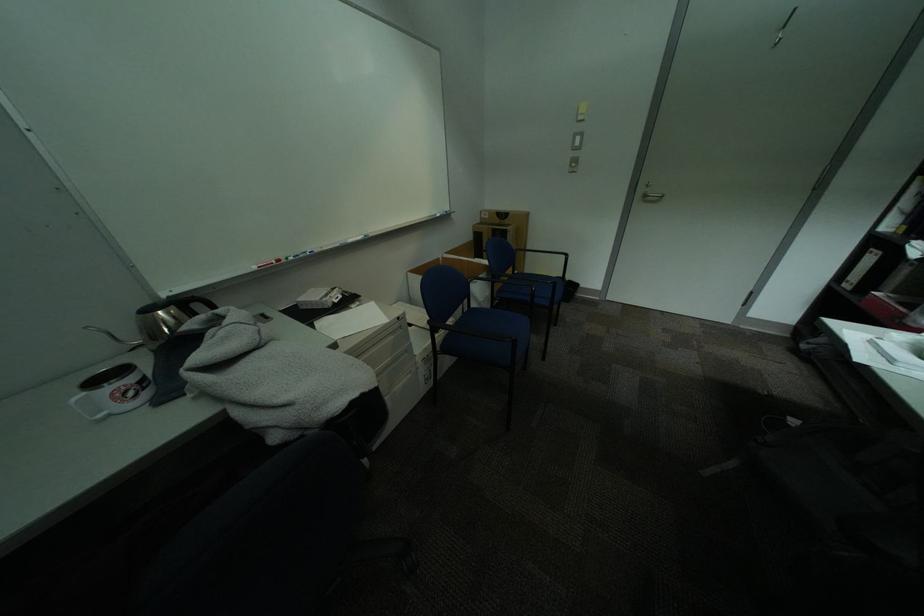
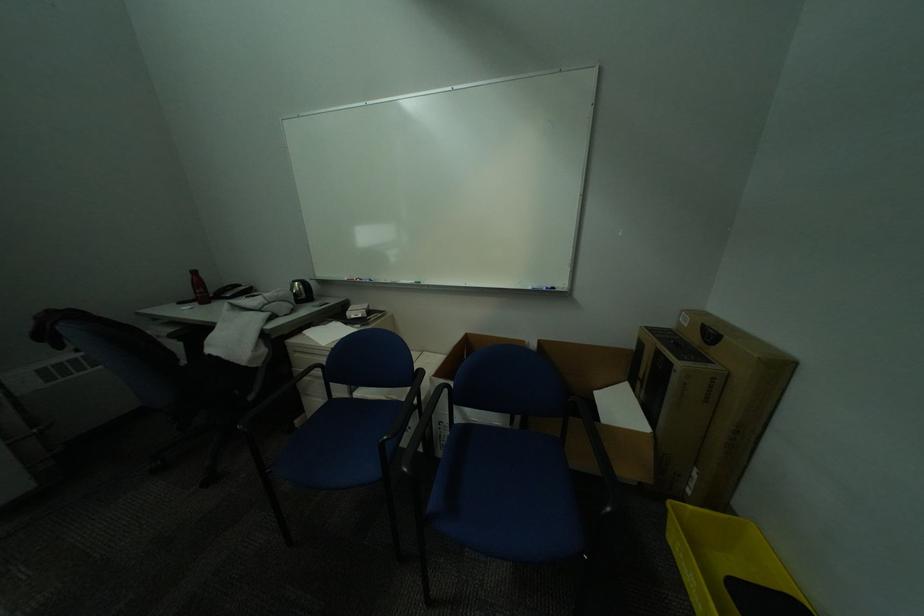
Locate, in the second image, the point that corresponds to the point at 448,216 in the first image.

(541, 289)